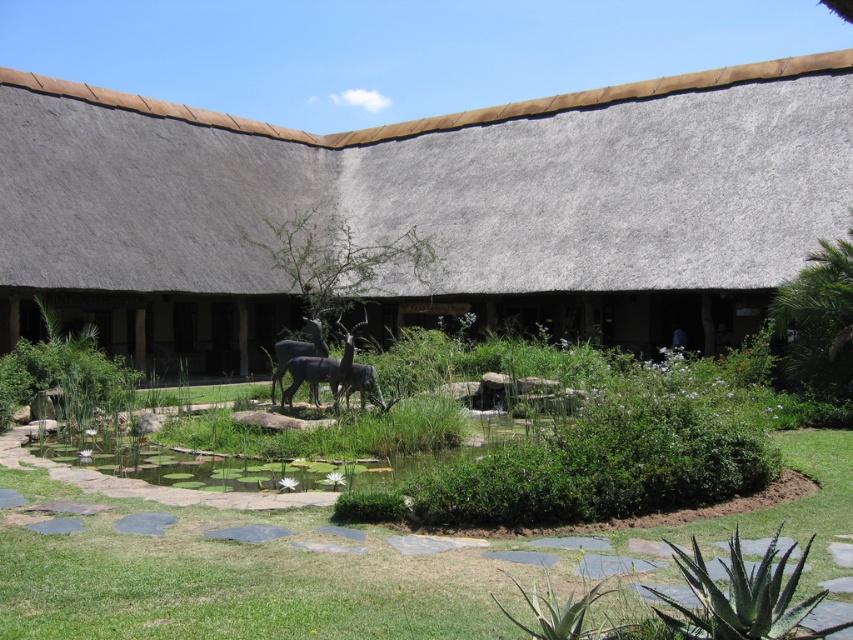
Question: Which object is positioned farthest from the thatched roof hut at center?

Choices:
 (A) green grass at center
 (B) polished bronze statue at center
 (C) green leafy pond at center

Answer: (A)

Question: Which object is closer to the camera taking this photo?

Choices:
 (A) gray stone statue at center
 (B) green grass at center
 (C) metallic gray statue at center

Answer: (B)

Question: Which is farther from the polished bronze statue at center?

Choices:
 (A) metallic gray statue at center
 (B) thatched roof hut at center
 (C) gray stone statue at center
 (D) green leafy pond at center

Answer: (B)

Question: Does thatched roof hut at center have a greater width compared to green grass at center?

Choices:
 (A) no
 (B) yes

Answer: (B)

Question: Does thatched roof hut at center have a greater width compared to gray stone statue at center?

Choices:
 (A) yes
 (B) no

Answer: (A)

Question: Can you confirm if green leafy pond at center is smaller than polished bronze statue at center?

Choices:
 (A) yes
 (B) no

Answer: (A)